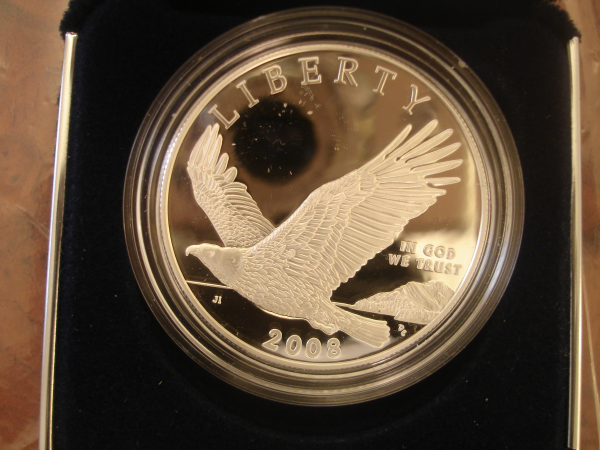
Locate an element on the screen. The image size is (600, 450). coin case is located at coordinates pyautogui.click(x=96, y=112).